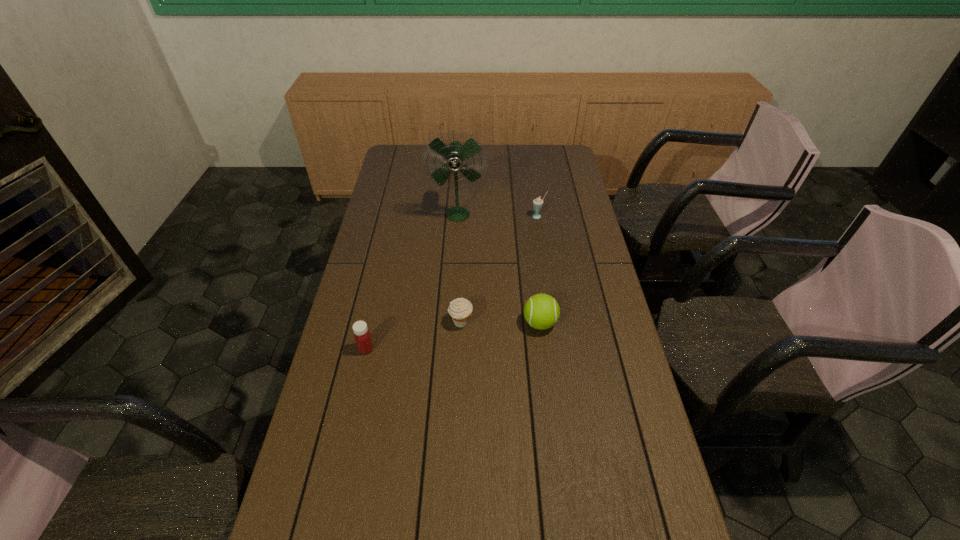
Where is `vacant space situated 0.400m on the front of the muffin`? Image resolution: width=960 pixels, height=540 pixels. vacant space situated 0.400m on the front of the muffin is located at coordinates (455, 463).

The height and width of the screenshot is (540, 960). Identify the location of object present at the left edge. (362, 336).

Find the location of `free location at the far edge`. free location at the far edge is located at coordinates (534, 150).

Locate an element on the screen. Image resolution: width=960 pixels, height=540 pixels. free space at the left edge of the desktop is located at coordinates (389, 214).

I want to click on vacant space at the right edge, so click(612, 354).

In the image, there is a desktop. Where is `free region at the far right corner`? free region at the far right corner is located at coordinates 569,154.

You are a GUI agent. You are given a task and a screenshot of the screen. Output one action in this format:
    pyautogui.click(x=<x>, y=<y>)
    Task: Click on the empty space between the muffin and the tennis ball
    
    Given the screenshot: What is the action you would take?
    pyautogui.click(x=500, y=322)

Where is `free spot between the leftmost object and the tennis ball`? free spot between the leftmost object and the tennis ball is located at coordinates (453, 336).

The height and width of the screenshot is (540, 960). In order to click on vacant space in between the milkshake and the muffin in this screenshot , I will do [499, 269].

This screenshot has height=540, width=960. Find the location of `free space between the tennis ball and the milkshake`. free space between the tennis ball and the milkshake is located at coordinates (540, 269).